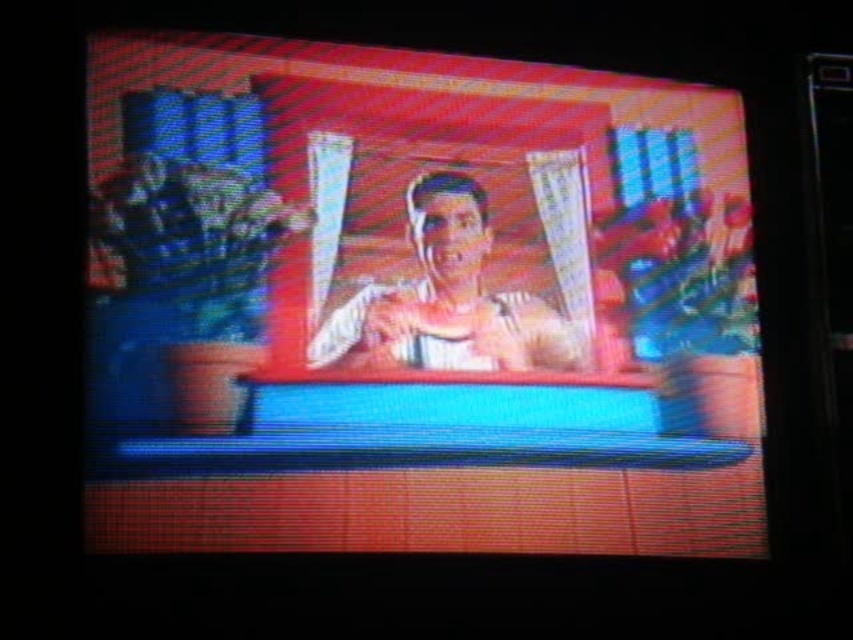
You are a GUI agent. You are given a task and a screenshot of the screen. Output one action in this format:
    pyautogui.click(x=<x>, y=<y>)
    Task: Click on the matte plastic screen at center
    The width and height of the screenshot is (853, 640).
    Given the screenshot: What is the action you would take?
    pyautogui.click(x=421, y=301)

Does matte plastic screen at center have a greater height compared to smooth beige shirt at center?

Correct, matte plastic screen at center is much taller as smooth beige shirt at center.

Is point (515, 276) farther from viewer compared to point (409, 204)?

Yes, it is behind point (409, 204).

Find the location of a particular element. matte plastic screen at center is located at coordinates (421, 301).